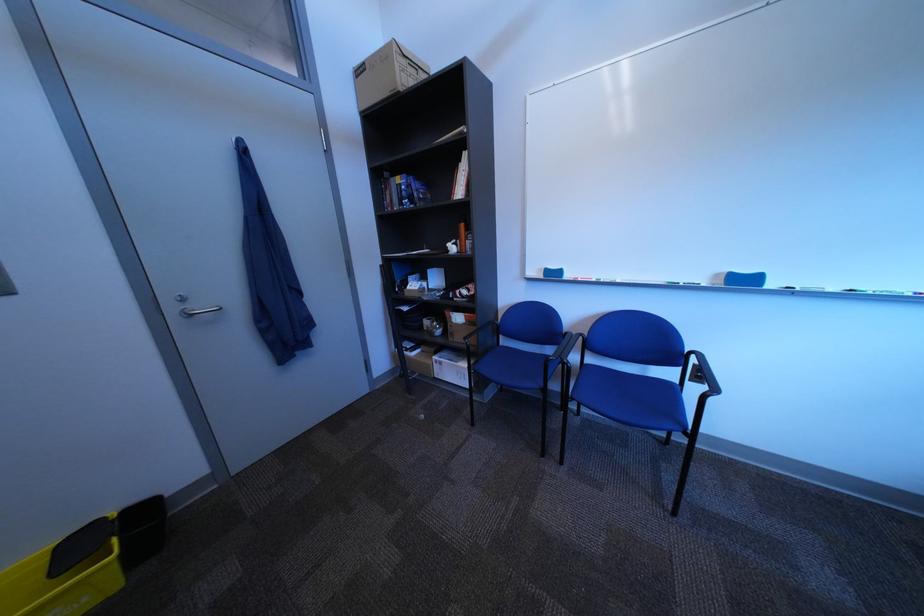
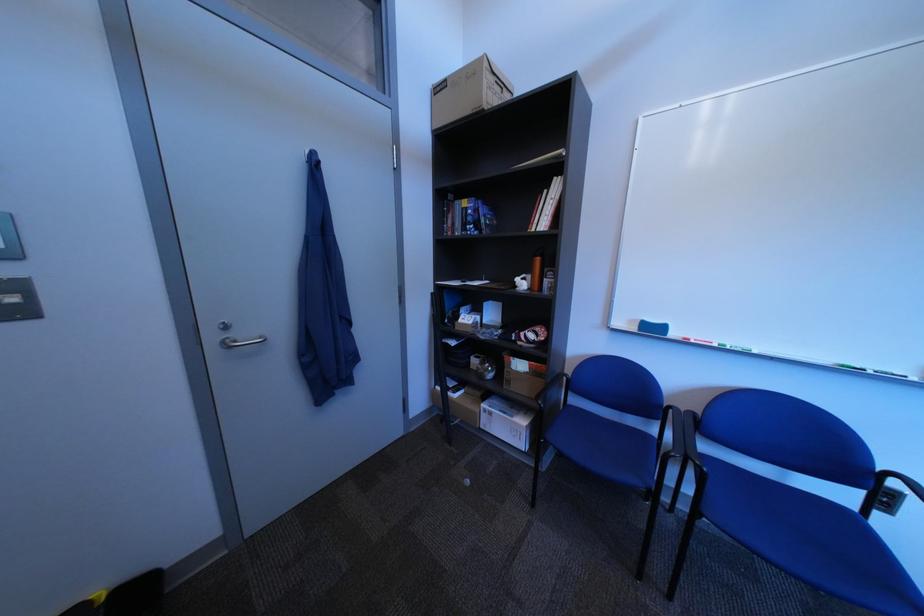
In the second image, find the point that corresponds to (468,336) in the first image.

(525, 383)